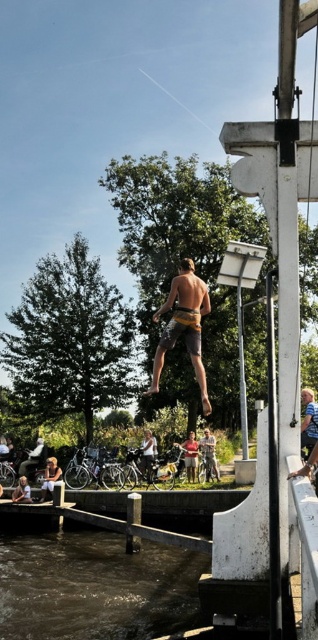
Does brown textured shorts at center appear under blue denim shorts at center?

No, brown textured shorts at center is not below blue denim shorts at center.

Is brown textured shorts at center positioned at the back of blue denim shorts at center?

No, brown textured shorts at center is closer to the viewer.

Identify the location of brown textured shorts at center. (184, 324).

Can you confirm if blue denim shorts at center is thinner than brown leather shorts at center?

No, blue denim shorts at center is not thinner than brown leather shorts at center.

Can you confirm if blue denim shorts at center is positioned above brown leather shorts at center?

Indeed, blue denim shorts at center is positioned over brown leather shorts at center.

In order to click on blue denim shorts at center in this screenshot , I will do `click(309, 420)`.

Consider the image. Can you confirm if brown murky water at lower left is positioned above light brown leather jacket at lower left?

No.

Is brown murky water at lower left shorter than light brown leather jacket at lower left?

Correct, brown murky water at lower left is not as tall as light brown leather jacket at lower left.

Find the location of a particular element. brown murky water at lower left is located at coordinates (95, 586).